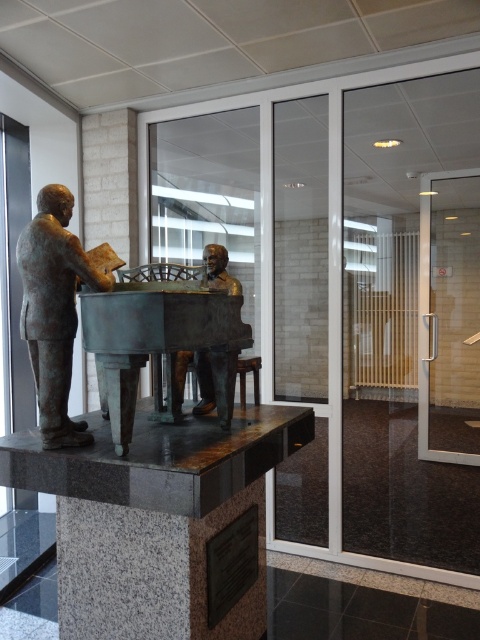
You are an art curator planning to move the bronze statue at left to a different gallery. If you remove it, will the bronze polished piano at center still be visible from the entrance?

The bronze polished piano at center is located below the bronze statue at left, so removing the statue would make the piano more visible from the entrance as there would be no obstruction.

You are standing at the center of the room and want to move towards the bronze statue at left. What direction should you move in?

Since the bronze statue at left is located at point 0.484 on the x and 0.113 on the y axis, you should move to the left to reach it.

You are an art curator arranging an exhibition. You need to place a label next to both the bronze statue at left and the bronze bust at center. Since you want the labels to be at the same height for consistency, which object should you adjust the label height for, and how?

The bronze statue at left is above bronze bust at center. Therefore, you should lower the label for the bronze statue at left to match the height of the bronze bust at center.